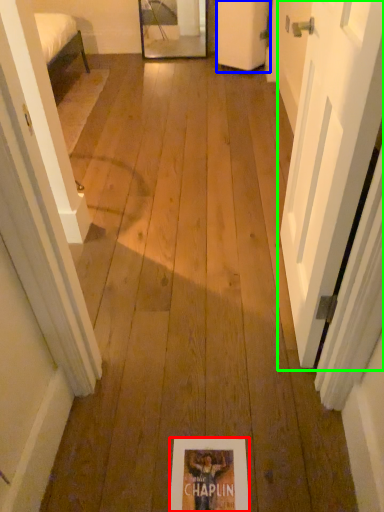
Question: Which object is positioned farthest from flyer (highlighted by a red box)? Select from door (highlighted by a blue box) and door (highlighted by a green box).

Choices:
 (A) door
 (B) door

Answer: (A)